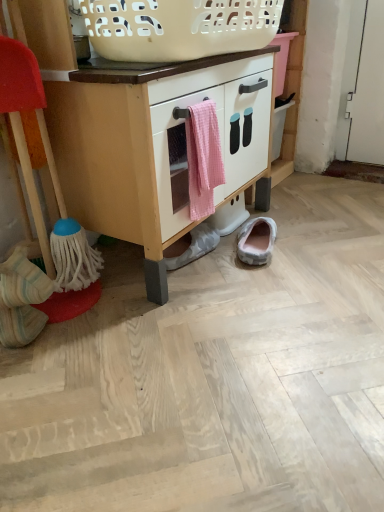
Question: Is gray suede slipper at lower center, acting as the third footwear starting from the left, looking in the opposite direction of white plastic basket at upper center?

Choices:
 (A) yes
 (B) no

Answer: (B)

Question: Does gray suede slipper at lower center, which is the third footwear from front to back, have a lesser width compared to white plastic basket at upper center?

Choices:
 (A) yes
 (B) no

Answer: (A)

Question: From the image's perspective, is gray suede slipper at lower center, positioned as the 1th footwear in back-to-front order, below white plastic basket at upper center?

Choices:
 (A) no
 (B) yes

Answer: (B)

Question: Can you confirm if gray suede slipper at lower center, positioned as the 1th footwear in back-to-front order, is shorter than white plastic basket at upper center?

Choices:
 (A) no
 (B) yes

Answer: (B)

Question: Does gray suede slipper at lower center, positioned as the 1th footwear in back-to-front order, have a greater width compared to white plastic basket at upper center?

Choices:
 (A) yes
 (B) no

Answer: (B)

Question: Are gray suede slipper at lower center, which is the third footwear from front to back, and white plastic basket at upper center located far from each other?

Choices:
 (A) no
 (B) yes

Answer: (A)

Question: Is pink gingham towel at center to the left of gray suede slipper at lower center, positioned as the 1th footwear in back-to-front order, from the viewer's perspective?

Choices:
 (A) yes
 (B) no

Answer: (A)

Question: Is pink gingham towel at center taller than gray suede slipper at lower center, acting as the third footwear starting from the left?

Choices:
 (A) yes
 (B) no

Answer: (A)

Question: Is pink gingham towel at center not close to gray suede slipper at lower center, acting as the third footwear starting from the left?

Choices:
 (A) no
 (B) yes

Answer: (A)

Question: Is pink gingham towel at center located outside gray suede slipper at lower center, which is the third footwear from front to back?

Choices:
 (A) no
 (B) yes

Answer: (B)

Question: Is pink gingham towel at center bigger than gray suede slipper at lower center, which is the third footwear from front to back?

Choices:
 (A) yes
 (B) no

Answer: (A)

Question: Does pink gingham towel at center have a greater width compared to gray suede slipper at lower center, acting as the third footwear starting from the left?

Choices:
 (A) yes
 (B) no

Answer: (B)

Question: Is the depth of white matte cabinet at center less than that of white striped socks at lower left, which is the 1th footwear in left-to-right order?

Choices:
 (A) no
 (B) yes

Answer: (B)